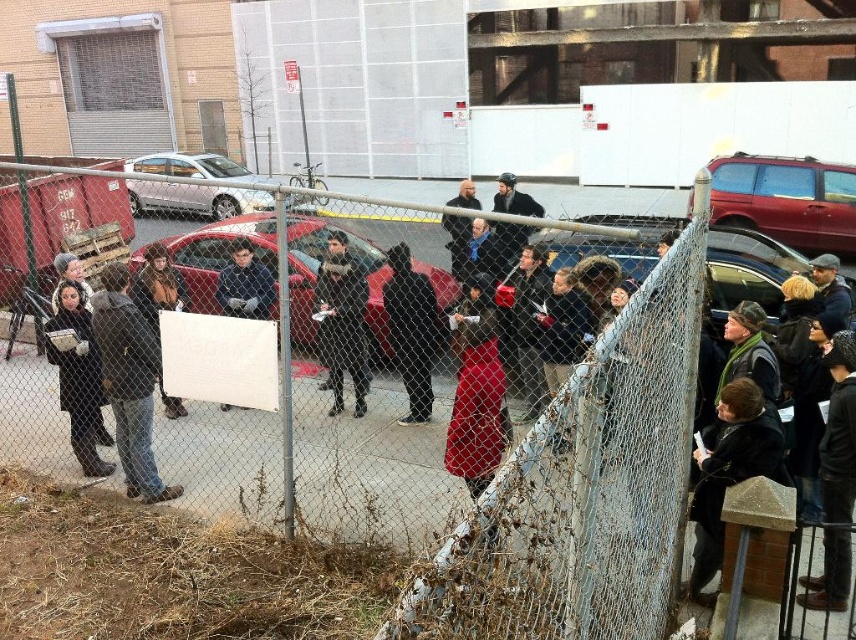
Question: Can you confirm if black wool coat at lower right is wider than dark gray sweater at center?

Choices:
 (A) no
 (B) yes

Answer: (B)

Question: Which point is farther from the camera taking this photo?

Choices:
 (A) (521, 234)
 (B) (239, 244)

Answer: (B)

Question: Is shiny red car at center closer to the viewer compared to dark gray coat at center?

Choices:
 (A) yes
 (B) no

Answer: (A)

Question: Which of the following is the farthest from the observer?

Choices:
 (A) dark gray helmet at center
 (B) shiny red car at center
 (C) velvet red dress at center

Answer: (B)

Question: Does shiny red car at center have a smaller size compared to leather jacket at center?

Choices:
 (A) no
 (B) yes

Answer: (A)

Question: Among these points, which one is farthest from the camera?

Choices:
 (A) (266, 289)
 (B) (177, 269)
 (C) (82, 406)

Answer: (C)